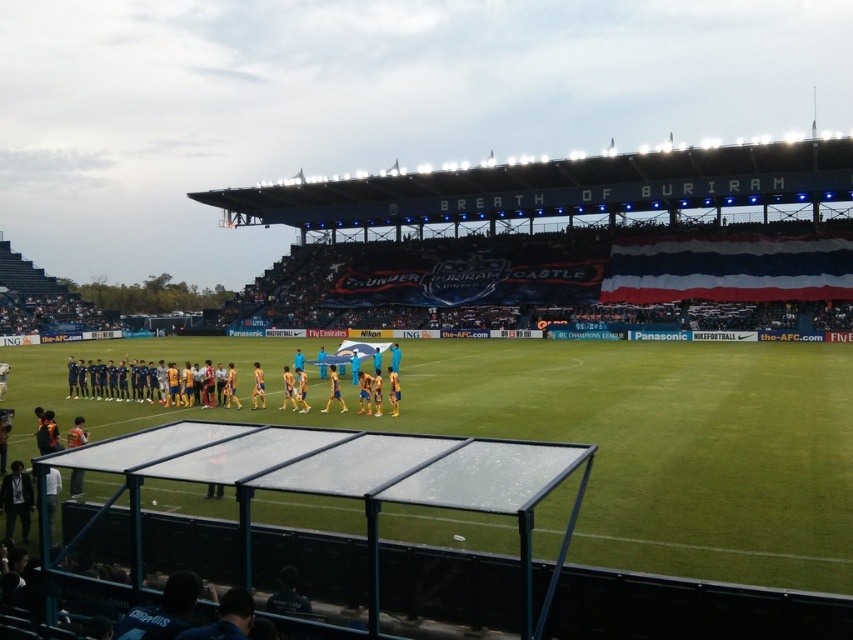
Consider the image. You are a photographer positioned at the edge of the field. You want to take a photo that includes both the green grass football field at center and the dark blue jersey at center. Which object will appear larger in your photo?

The green grass football field at center will appear larger in the photo because it is closer to the viewer than the dark blue jersey at center.

Consider the image. You are a photographer positioned at the edge of the field. You want to take a photo of the green grass football field at center and the dark blue jersey at center so that both are clearly visible. Based on their relative heights, which object should you focus on first to ensure both are in focus?

The green grass football field at center is taller than the dark blue jersey at center. To ensure both are in focus, you should focus on the taller object first, which is the green grass football field at center.

You are a photographer standing at the edge of the field. You want to take a picture of the dark blue jersey at center and the green grass football field at center. Which object is more to the right in the frame?

The green grass football field at center is positioned on the right side of the dark blue jersey at center, so it is more to the right in the frame.